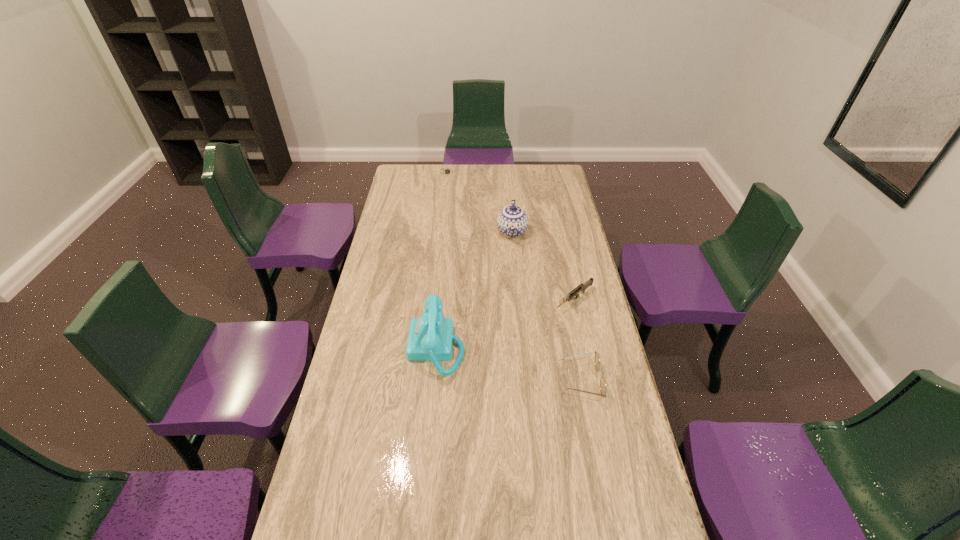
Find the location of a particular element. object that can be found as the third closest to the gun is located at coordinates (430, 338).

Identify the location of free spot that satisfies the following two spatial constraints: 1. on the front side of the third object from right to left; 2. on the front-facing side of the spectacles. (525, 380).

I want to click on free space that satisfies the following two spatial constraints: 1. on the front side of the watch; 2. on the right side of the gun, so click(x=434, y=300).

The width and height of the screenshot is (960, 540). What are the coordinates of `free spot that satisfies the following two spatial constraints: 1. on the front side of the spectacles; 2. on the front-facing side of the shortest object` in the screenshot? It's located at (425, 380).